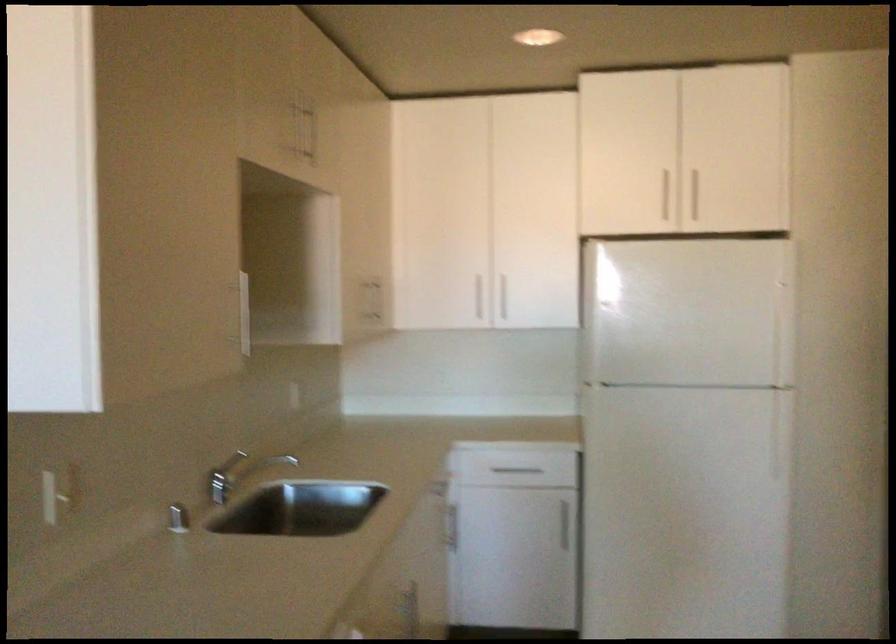
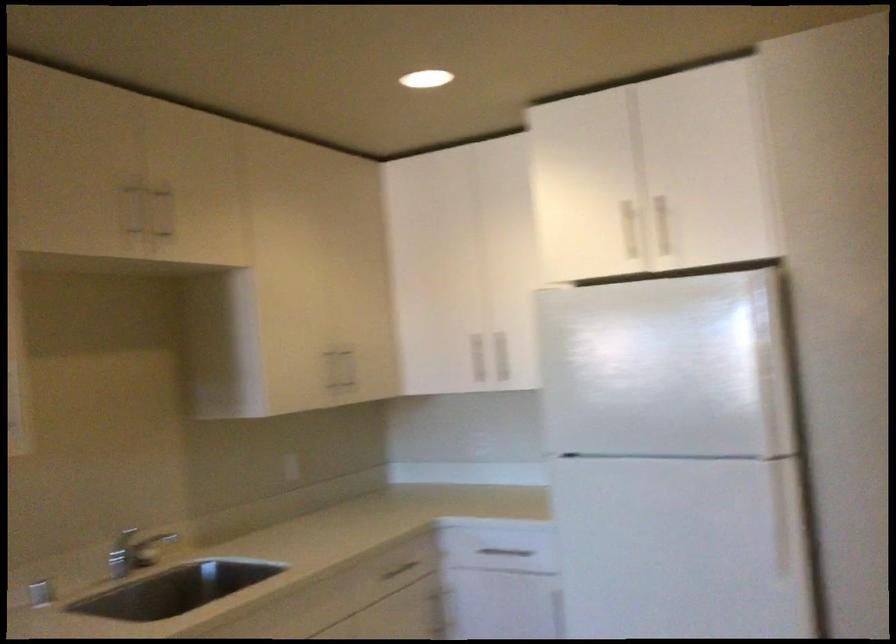
The images are taken continuously from a first-person perspective. In which direction are you moving?

The movement direction of the cameraman is right, forward.